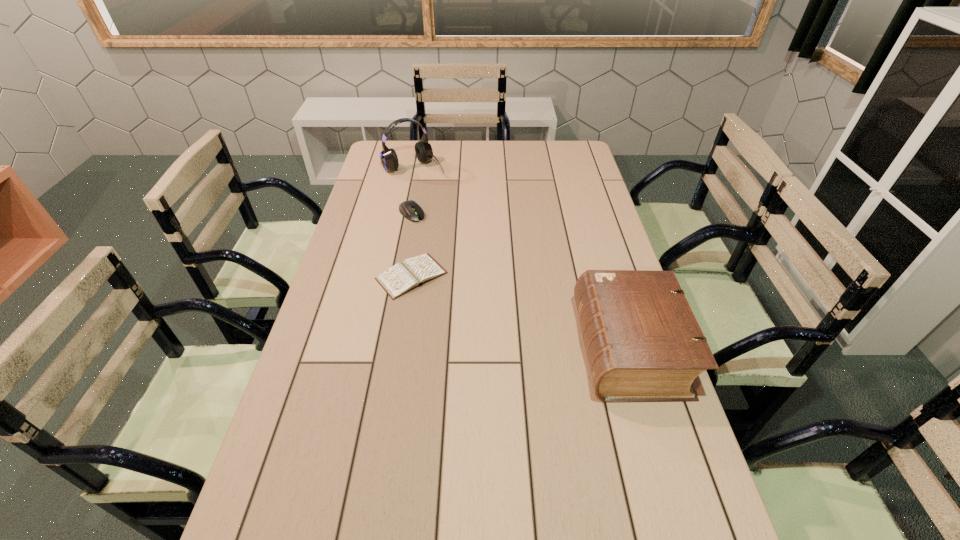
Find the location of a particular element. This screenshot has height=540, width=960. free space located 0.180m on the spine side of the nearest object is located at coordinates (513, 348).

The width and height of the screenshot is (960, 540). What are the coordinates of `free point located 0.230m on the spine side of the nearest object` in the screenshot? It's located at (494, 348).

Identify the location of vacant point located on the wheel side of the second farthest object. The width and height of the screenshot is (960, 540). (471, 274).

The image size is (960, 540). I want to click on vacant space located 0.160m on the wheel side of the second farthest object, so click(442, 245).

You are a GUI agent. You are given a task and a screenshot of the screen. Output one action in this format:
    pyautogui.click(x=<x>, y=<y>)
    Task: Click on the free location located on the wheel side of the second farthest object
    Image resolution: width=960 pixels, height=540 pixels.
    Given the screenshot: What is the action you would take?
    pyautogui.click(x=442, y=245)

In order to click on vacant space located 0.230m on the ear cushions of the farthest object in this screenshot , I will do `click(450, 207)`.

Identify the location of free spot located on the ear cushions of the farthest object. This screenshot has height=540, width=960. (460, 219).

You are a GUI agent. You are given a task and a screenshot of the screen. Output one action in this format:
    pyautogui.click(x=<x>, y=<y>)
    Task: Click on the vacant space located on the ear cushions of the farthest object
    The image size is (960, 540).
    Given the screenshot: What is the action you would take?
    pyautogui.click(x=462, y=221)

Identify the location of object that is positioned at the far edge. The width and height of the screenshot is (960, 540). (389, 160).

At what (x,y) coordinates should I click in order to perform the action: click on diary located at the left edge. Please return your answer as a coordinate pair (x, y). This screenshot has height=540, width=960. Looking at the image, I should click on (402, 277).